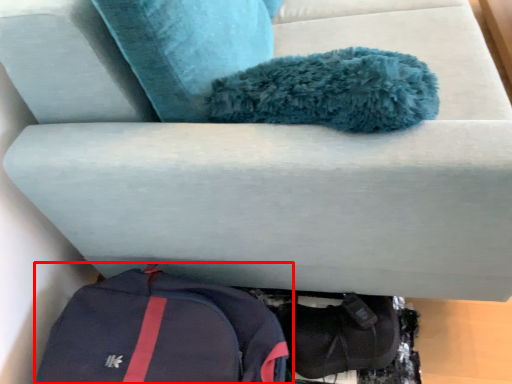
Question: Where is backpack (annotated by the red box) located in relation to shoe in the image?

Choices:
 (A) right
 (B) left

Answer: (B)